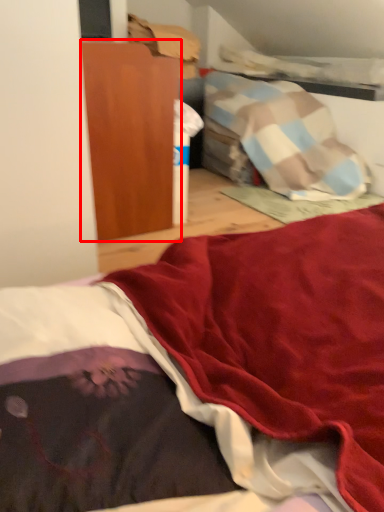
Question: From the image's perspective, where is furniture (annotated by the red box) located relative to bed?

Choices:
 (A) below
 (B) above

Answer: (B)